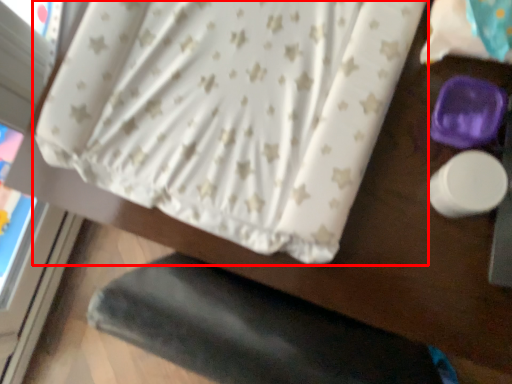
Question: Observing the image, what is the correct spatial positioning of curtain (annotated by the red box) in reference to sheet?

Choices:
 (A) right
 (B) left

Answer: (B)